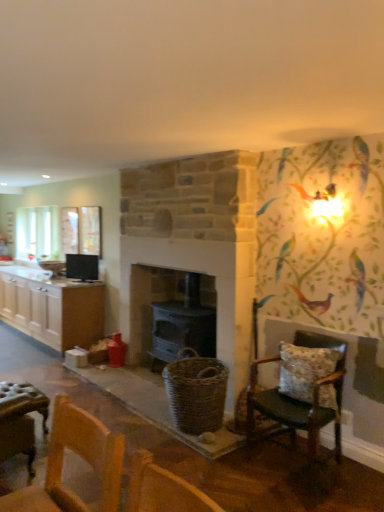
Question: Can you see black glossy monitor at upper left touching floral fabric cushioned chair at right?

Choices:
 (A) no
 (B) yes

Answer: (A)

Question: Can you confirm if black glossy monitor at upper left is positioned to the right of floral fabric cushioned chair at right?

Choices:
 (A) no
 (B) yes

Answer: (A)

Question: Does black glossy monitor at upper left turn towards floral fabric cushioned chair at right?

Choices:
 (A) yes
 (B) no

Answer: (B)

Question: Is floral fabric cushioned chair at right at the back of black glossy monitor at upper left?

Choices:
 (A) yes
 (B) no

Answer: (B)

Question: Does black glossy monitor at upper left appear on the left side of floral fabric cushioned chair at right?

Choices:
 (A) no
 (B) yes

Answer: (B)

Question: Is fluffy fabric pillow at right bigger or smaller than matte black stove at center?

Choices:
 (A) small
 (B) big

Answer: (A)

Question: From the image's perspective, is fluffy fabric pillow at right above or below matte black stove at center?

Choices:
 (A) below
 (B) above

Answer: (A)

Question: Considering the positions of fluffy fabric pillow at right and matte black stove at center in the image, is fluffy fabric pillow at right wider or thinner than matte black stove at center?

Choices:
 (A) thin
 (B) wide

Answer: (A)

Question: Is fluffy fabric pillow at right in front of or behind matte black stove at center in the image?

Choices:
 (A) front
 (B) behind

Answer: (A)

Question: Is fluffy fabric pillow at right inside the boundaries of black glossy monitor at upper left, or outside?

Choices:
 (A) inside
 (B) outside

Answer: (B)

Question: Is point (286, 371) positioned closer to the camera than point (82, 262)?

Choices:
 (A) farther
 (B) closer

Answer: (B)

Question: Considering their positions, is fluffy fabric pillow at right located in front of or behind black glossy monitor at upper left?

Choices:
 (A) front
 (B) behind

Answer: (A)

Question: From a real-world perspective, is fluffy fabric pillow at right physically located above or below black glossy monitor at upper left?

Choices:
 (A) above
 (B) below

Answer: (B)

Question: From a real-world perspective, is white wood cabinets at left above or below floral fabric cushioned chair at right?

Choices:
 (A) below
 (B) above

Answer: (A)

Question: Looking at their shapes, would you say white wood cabinets at left is wider or thinner than floral fabric cushioned chair at right?

Choices:
 (A) thin
 (B) wide

Answer: (B)